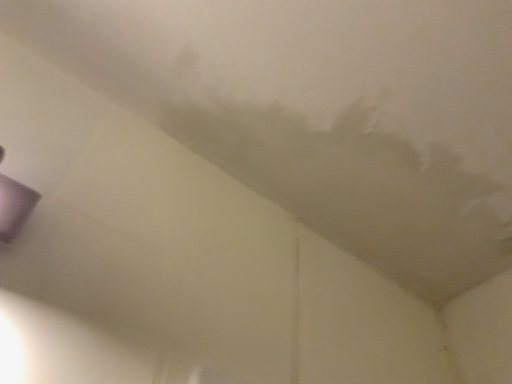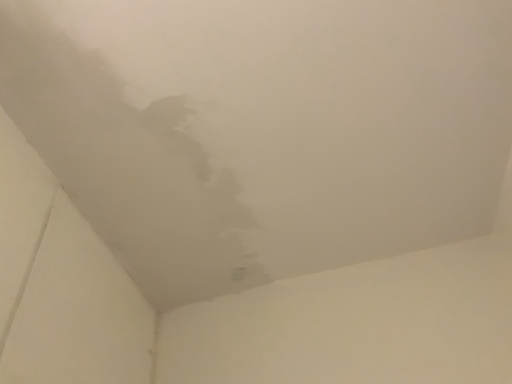
Question: Which way did the camera rotate in the video?

Choices:
 (A) rotated right
 (B) rotated left

Answer: (A)